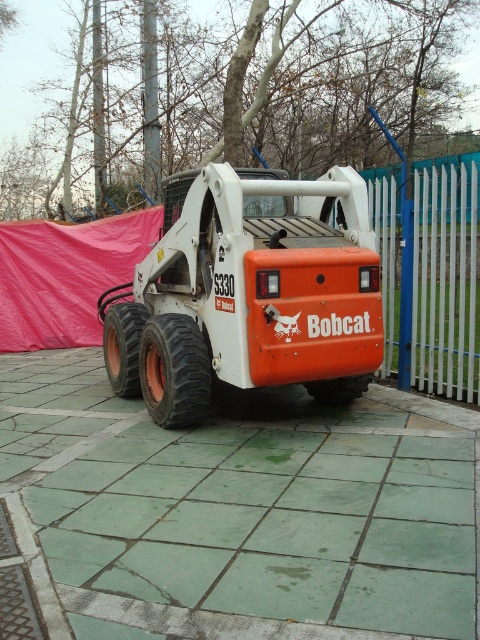
Question: Is green tile pavement at center to the left of orange matte bobcat at center from the viewer's perspective?

Choices:
 (A) no
 (B) yes

Answer: (A)

Question: Which point is closer to the camera?

Choices:
 (A) green tile pavement at center
 (B) orange matte bobcat at center

Answer: (A)

Question: Among these points, which one is nearest to the camera?

Choices:
 (A) (277, 257)
 (B) (458, 472)

Answer: (B)

Question: Does orange matte bobcat at center appear on the left side of white metal fence at right?

Choices:
 (A) yes
 (B) no

Answer: (A)

Question: Does orange matte bobcat at center have a smaller size compared to white metal fence at right?

Choices:
 (A) yes
 (B) no

Answer: (B)

Question: Which of the following is the farthest from the observer?

Choices:
 (A) green tile pavement at center
 (B) orange matte bobcat at center
 (C) white metal fence at right

Answer: (C)